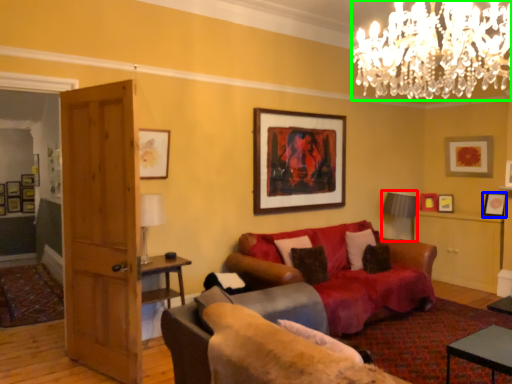
Question: Considering the real-world distances, which object is farthest from lamp (highlighted by a red box)? picture frame (highlighted by a blue box) or lamp (highlighted by a green box)?

Choices:
 (A) picture frame
 (B) lamp

Answer: (B)